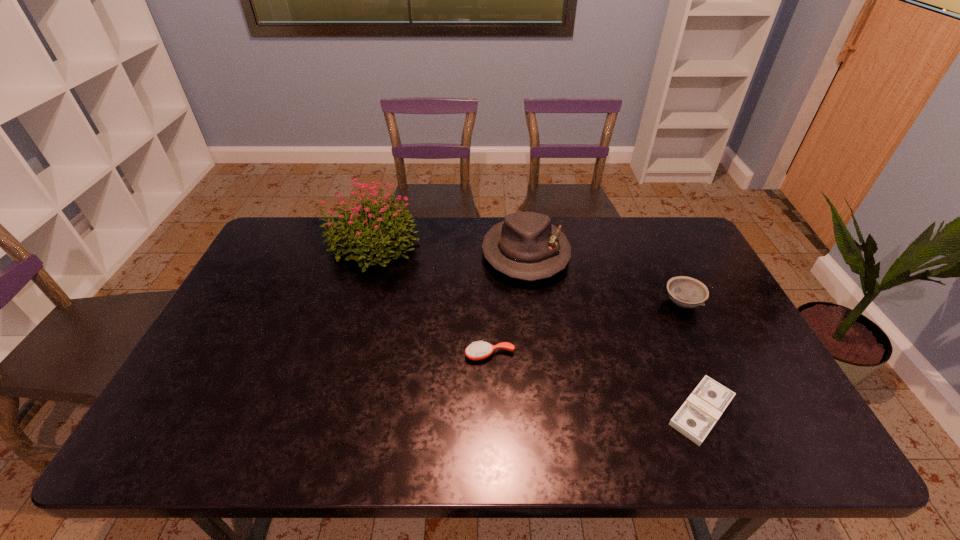
At what (x,y) coordinates should I click in order to perform the action: click on bouquet. Please return your answer as a coordinate pair (x, y). The image size is (960, 540). Looking at the image, I should click on (373, 227).

Image resolution: width=960 pixels, height=540 pixels. I want to click on the tallest object, so click(373, 227).

This screenshot has width=960, height=540. I want to click on the second tallest object, so pyautogui.click(x=526, y=246).

Where is `bowl`? The width and height of the screenshot is (960, 540). bowl is located at coordinates (686, 292).

The height and width of the screenshot is (540, 960). In order to click on the third shortest object in this screenshot , I will do `click(686, 292)`.

Locate an element on the screen. This screenshot has width=960, height=540. hairbrush is located at coordinates (476, 350).

Locate an element on the screen. The width and height of the screenshot is (960, 540). the second nearest object is located at coordinates point(476,350).

This screenshot has width=960, height=540. I want to click on dollar, so click(x=696, y=417).

Image resolution: width=960 pixels, height=540 pixels. I want to click on the nearest object, so click(x=696, y=417).

You are a GUI agent. You are given a task and a screenshot of the screen. Output one action in this format:
    pyautogui.click(x=<x>, y=<y>)
    Task: Click on the free space located 0.110m on the left of the leftmost object
    The width and height of the screenshot is (960, 540).
    Given the screenshot: What is the action you would take?
    pyautogui.click(x=292, y=244)